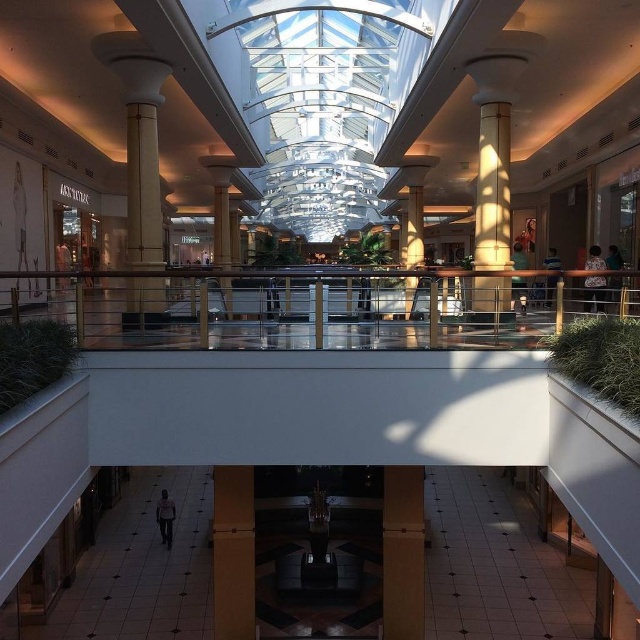
Consider the image. You are a maintenance worker who needs to reach the metallic polished rail at center. You have a ladder that is 6 meters long. Can you safely reach the rail with the ladder?

The metallic polished rail at center is 6.76 meters away from the viewer. Since the ladder is only 6 meters long, it is not long enough to safely reach the rail. You will need a longer ladder or alternative equipment.

You are a maintenance worker needing to replace a part that requires a larger surface area. You see the metallic polished rail at center and the white glossy column at center. Which object should you choose for the replacement part?

The metallic polished rail at center has a larger size compared to the white glossy column at center, so you should choose the metallic polished rail at center for the replacement part since it offers a larger surface area.